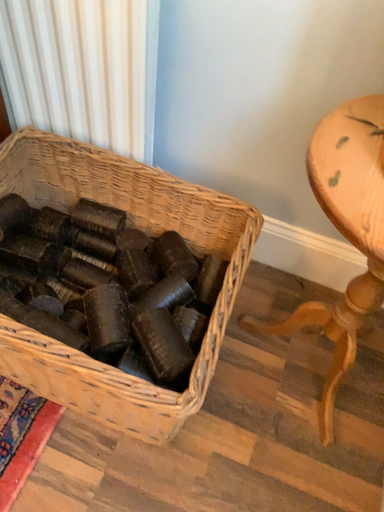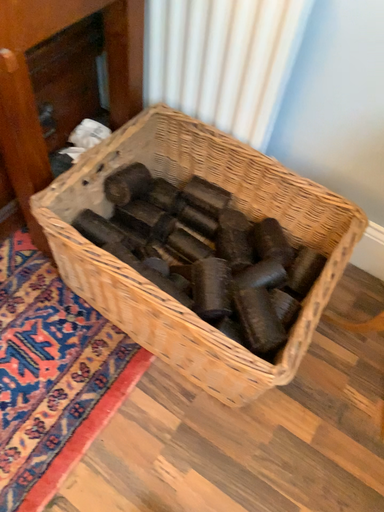
Question: Which way did the camera rotate in the video?

Choices:
 (A) rotated right
 (B) rotated left

Answer: (B)